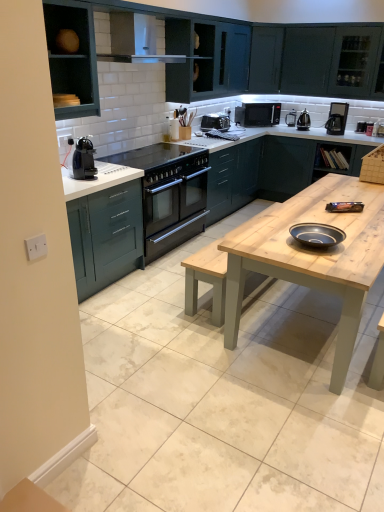
Locate an element on the screen. unoccupied space behind matte blue bowl at center is located at coordinates (320, 225).